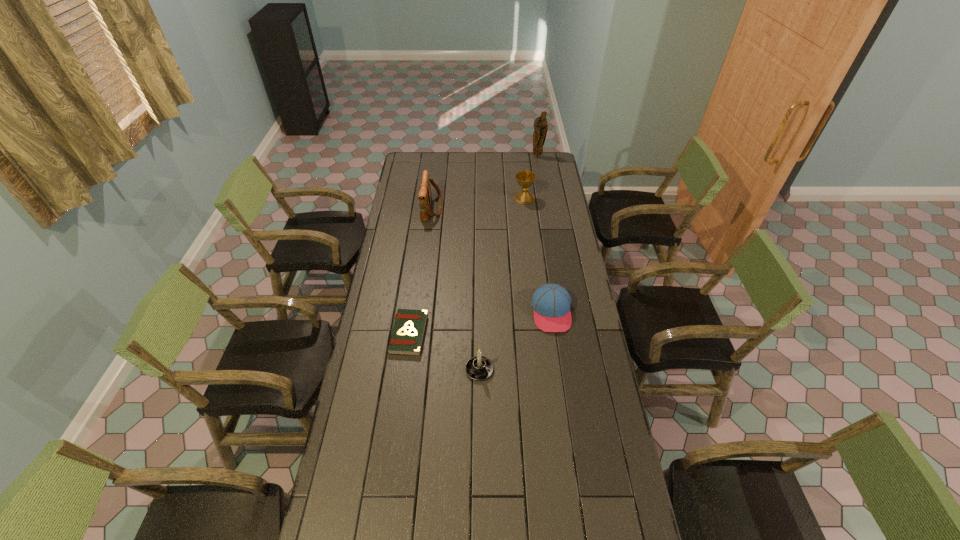
Where is `empty location between the fifth tallest object and the fourth object from right to left`? empty location between the fifth tallest object and the fourth object from right to left is located at coordinates [516, 341].

Locate an element on the screen. Image resolution: width=960 pixels, height=540 pixels. vacant space in between the baseball cap and the second tallest object is located at coordinates (492, 260).

Locate an element on the screen. vacant region between the chalice and the shortest object is located at coordinates (467, 266).

Locate an element on the screen. The image size is (960, 540). free area in between the chalice and the nearest object is located at coordinates (502, 284).

Find the location of a particular element. free space between the fifth shortest object and the shortest object is located at coordinates (420, 271).

You are a GUI agent. You are given a task and a screenshot of the screen. Output one action in this format:
    pyautogui.click(x=<x>, y=<y>)
    Task: Click on the free spot between the book and the chalice
    This screenshot has width=960, height=540.
    Given the screenshot: What is the action you would take?
    (x=467, y=266)

Locate an element on the screen. free space between the second shortest object and the figurine is located at coordinates (544, 234).

At what (x,y) coordinates should I click in order to perform the action: click on the fourth closest object to the fifth tallest object. Please return your answer as a coordinate pair (x, y). The height and width of the screenshot is (540, 960). Looking at the image, I should click on (424, 196).

The width and height of the screenshot is (960, 540). I want to click on object that is the fifth closest one to the third object from left to right, so [x=540, y=124].

Image resolution: width=960 pixels, height=540 pixels. Identify the location of free space that satisfies the following two spatial constraints: 1. on the front-facing side of the figurine; 2. on the front-facing side of the shoulder bag. (546, 208).